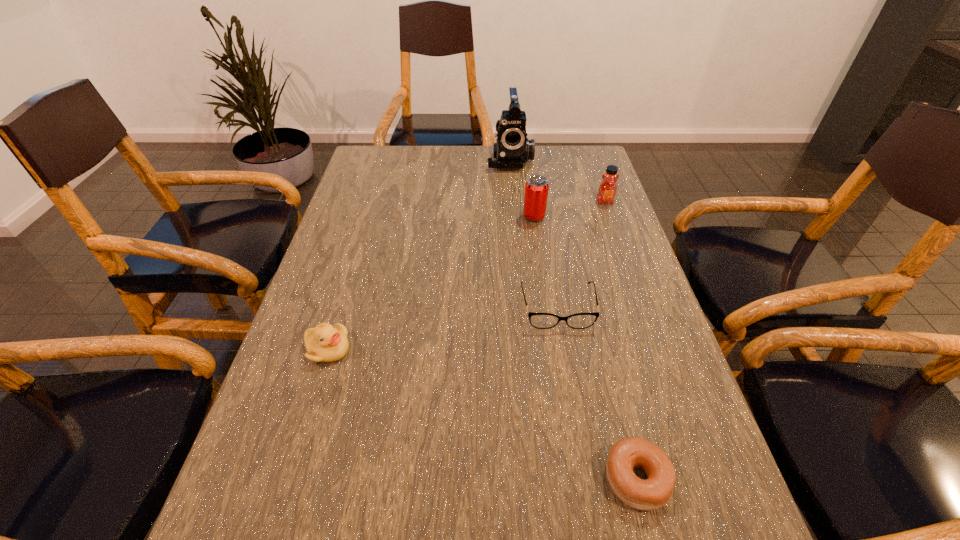
Point out which object is positioned as the third nearest to the honey. Please provide its 2D coordinates. Your answer should be formatted as a tuple, i.e. [(x, y)], where the tuple contains the x and y coordinates of a point satisfying the conditions above.

[(538, 320)]

Where is `object that is the second closest to the third shortest object`? This screenshot has width=960, height=540. object that is the second closest to the third shortest object is located at coordinates (631, 453).

The width and height of the screenshot is (960, 540). I want to click on free region that satisfies the following two spatial constraints: 1. on the front label of the second farthest object; 2. on the front-facing side of the third shortest object, so click(x=658, y=349).

Identify the location of vacant space that satisfies the following two spatial constraints: 1. on the lens mount of the tallest object; 2. on the front-facing side of the leftmost object. (528, 349).